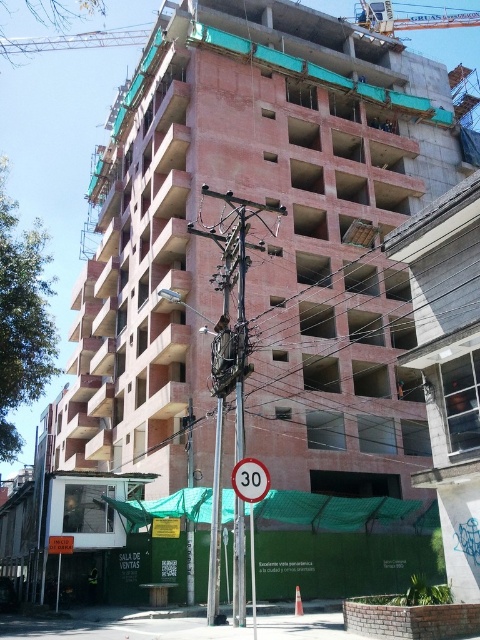
From the picture: You are a construction worker standing at the entrance of the construction site. You need to move a heavy beam from the metallic pole at center to the metallic gray crane at upper left. Can you safely move the beam directly between them without obstruction?

The metallic pole at center is in front of the metallic gray crane at upper left, so moving the beam directly between them would not be possible as the pole blocks the path.